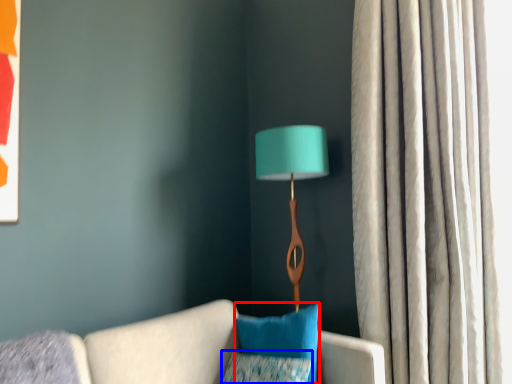
Question: Among these objects, which one is farthest to the camera, pillow (highlighted by a red box) or pillow (highlighted by a blue box)?

Choices:
 (A) pillow
 (B) pillow

Answer: (A)